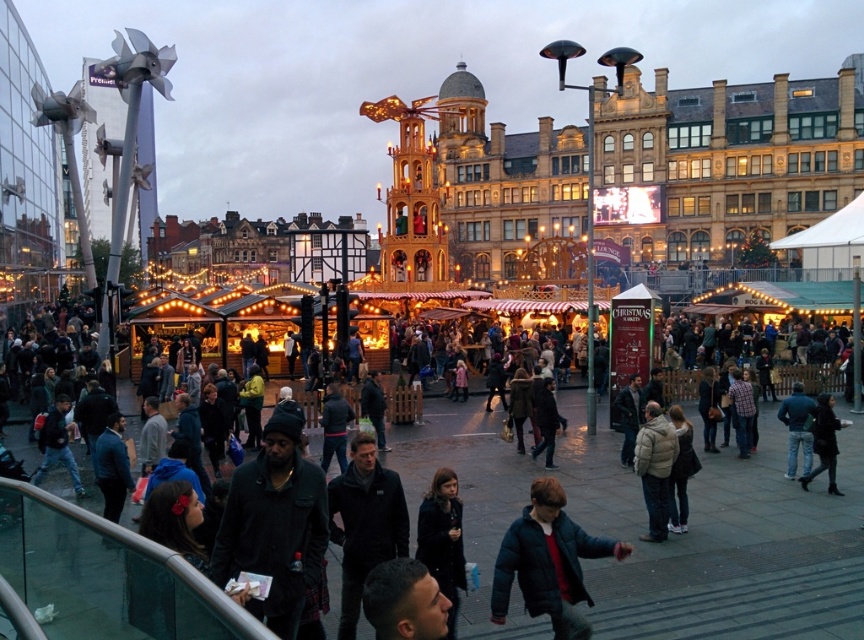
Question: Which object appears farthest from the camera in this image?

Choices:
 (A) dark blue jacket at center
 (B) dark gray jacket at center

Answer: (B)

Question: Is dark blue jacket at center thinner than dark gray jacket at center?

Choices:
 (A) yes
 (B) no

Answer: (B)

Question: Is dark blue jacket at center below dark gray jacket at center?

Choices:
 (A) no
 (B) yes

Answer: (B)

Question: Which point is closer to the camera?

Choices:
 (A) (642, 476)
 (B) (602, 548)

Answer: (B)

Question: Can you confirm if dark blue jacket at center is positioned below dark gray jacket at center?

Choices:
 (A) yes
 (B) no

Answer: (A)

Question: Which object appears farthest from the camera in this image?

Choices:
 (A) dark blue jacket at center
 (B) dark gray jacket at center

Answer: (B)